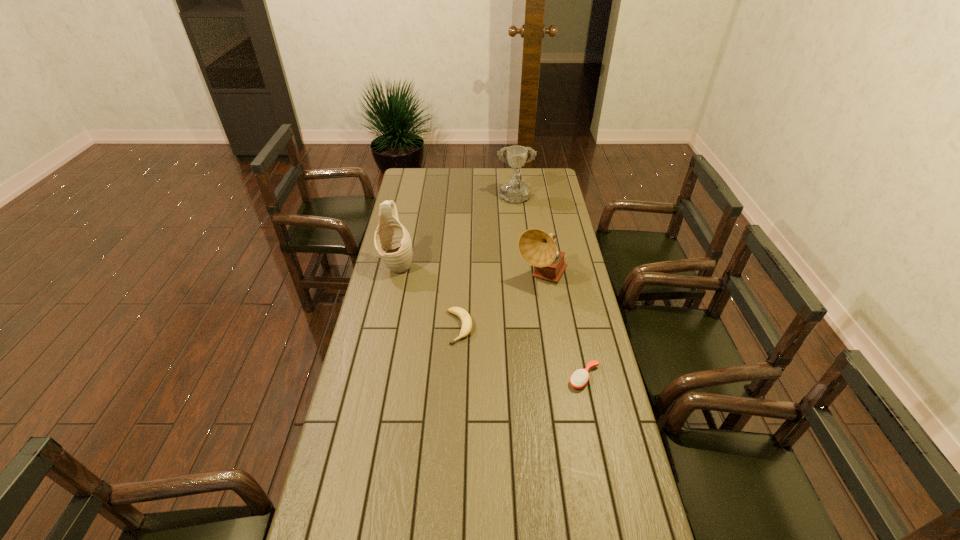
You are a GUI agent. You are given a task and a screenshot of the screen. Output one action in this format:
    pyautogui.click(x=<x>, y=<y>)
    Task: Click on the vacant area in the image that satisfies the following two spatial constraints: 1. on the horn of the hairbrush; 2. on the right side of the phonograph record
    This screenshot has width=960, height=540.
    Given the screenshot: What is the action you would take?
    pyautogui.click(x=558, y=377)

Where is `vacant space that satisfies the following two spatial constraints: 1. at the spout of the pitcher; 2. on the right side of the fourth farthest object`? This screenshot has width=960, height=540. vacant space that satisfies the following two spatial constraints: 1. at the spout of the pitcher; 2. on the right side of the fourth farthest object is located at coordinates (384, 327).